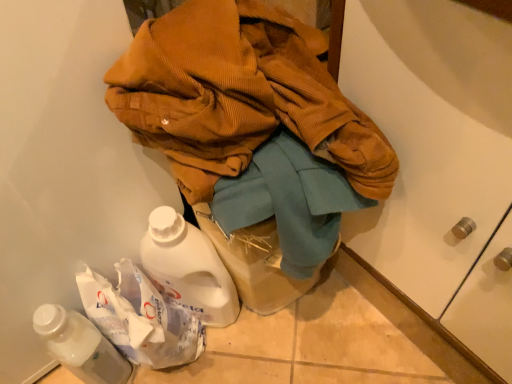
In order to face white plastic bottle at lower left, should I rotate leftwards or rightwards?

It's best to rotate left around 22.623 degrees.

Locate an element on the screen. white plastic bottle at lower left is located at coordinates (80, 346).

The height and width of the screenshot is (384, 512). What do you see at coordinates (80, 346) in the screenshot? I see `white plastic bottle at lower left` at bounding box center [80, 346].

What do you see at coordinates (240, 96) in the screenshot? The width and height of the screenshot is (512, 384). I see `brown corduroy jacket at center` at bounding box center [240, 96].

You are a GUI agent. You are given a task and a screenshot of the screen. Output one action in this format:
    pyautogui.click(x=<x>, y=<y>)
    Task: Click on the brown corduroy jacket at center
    The image size is (512, 384).
    Given the screenshot: What is the action you would take?
    pyautogui.click(x=240, y=96)

I want to click on white plastic bottle at lower left, so click(x=80, y=346).

Visually, is brown corduroy jacket at center positioned to the left or to the right of white plastic bottle at lower left?

Clearly, brown corduroy jacket at center is on the right of white plastic bottle at lower left in the image.

Is the depth of brown corduroy jacket at center greater than that of white plastic bottle at lower left?

No, it is in front of white plastic bottle at lower left.

Is point (118, 83) more distant than point (90, 360)?

No, it is in front of (90, 360).

From the image's perspective, relative to white plastic bottle at lower left, is brown corduroy jacket at center above or below?

From the image's perspective, brown corduroy jacket at center appears above white plastic bottle at lower left.

From a real-world perspective, is brown corduroy jacket at center over white plastic bottle at lower left?

Yes, from a real-world perspective, brown corduroy jacket at center is on top of white plastic bottle at lower left.

Which object is wider, brown corduroy jacket at center or white plastic bottle at lower left?

With larger width is brown corduroy jacket at center.

Between brown corduroy jacket at center and white plastic bottle at lower left, which one has more height?

Standing taller between the two is brown corduroy jacket at center.

Considering the sizes of brown corduroy jacket at center and white plastic bottle at lower left in the image, is brown corduroy jacket at center bigger or smaller than white plastic bottle at lower left?

Clearly, brown corduroy jacket at center is larger in size than white plastic bottle at lower left.

Is white plastic bottle at lower left surrounded by brown corduroy jacket at center?

Definitely not — white plastic bottle at lower left is not inside brown corduroy jacket at center.

Is there a large distance between brown corduroy jacket at center and white plastic bottle at lower left?

No, there isn't a large distance between brown corduroy jacket at center and white plastic bottle at lower left.

Is brown corduroy jacket at center aimed at white plastic bottle at lower left?

Yes.

How different are the orientations of brown corduroy jacket at center and white plastic bottle at lower left in degrees?

They differ by 0.345 degrees in their facing directions.

Identify the location of bottle that appears below the brown corduroy jacket at center (from the image's perspective). Image resolution: width=512 pixels, height=384 pixels. click(x=80, y=346).

Considering the relative positions of white plastic bottle at lower left and brown corduroy jacket at center in the image provided, is white plastic bottle at lower left to the right of brown corduroy jacket at center from the viewer's perspective?

No.

Based on the photo, is the position of white plastic bottle at lower left more distant than that of brown corduroy jacket at center?

Yes, it is.

Does point (60, 356) come in front of point (160, 88)?

No, it is behind (160, 88).

From the image's perspective, is white plastic bottle at lower left positioned above or below brown corduroy jacket at center?

white plastic bottle at lower left is below brown corduroy jacket at center.

From a real-world perspective, is white plastic bottle at lower left above or below brown corduroy jacket at center?

white plastic bottle at lower left is below brown corduroy jacket at center.

Looking at their sizes, would you say white plastic bottle at lower left is wider or thinner than brown corduroy jacket at center?

Clearly, white plastic bottle at lower left has less width compared to brown corduroy jacket at center.

In the scene shown: Who is shorter, white plastic bottle at lower left or brown corduroy jacket at center?

white plastic bottle at lower left.

Looking at the image, does white plastic bottle at lower left seem bigger or smaller compared to brown corduroy jacket at center?

Clearly, white plastic bottle at lower left is smaller in size than brown corduroy jacket at center.

Is white plastic bottle at lower left located outside brown corduroy jacket at center?

Yes, white plastic bottle at lower left is not within brown corduroy jacket at center.

Are white plastic bottle at lower left and brown corduroy jacket at center located far from each other?

No.

In the scene shown: Is white plastic bottle at lower left looking in the opposite direction of brown corduroy jacket at center?

Yes, white plastic bottle at lower left is positioned with its back facing brown corduroy jacket at center.

How many degrees apart are the facing directions of white plastic bottle at lower left and brown corduroy jacket at center?

The angular difference between white plastic bottle at lower left and brown corduroy jacket at center is 0.345 degrees.

In order to click on jacket that is above the white plastic bottle at lower left (from the image's perspective) in this screenshot , I will do `click(240, 96)`.

The image size is (512, 384). What are the coordinates of `bottle located behind the brown corduroy jacket at center` in the screenshot? It's located at (80, 346).

This screenshot has width=512, height=384. What are the coordinates of `bottle located on the left of brown corduroy jacket at center` in the screenshot? It's located at (80, 346).